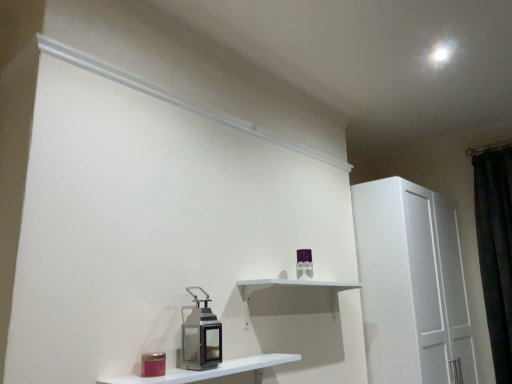
What do you see at coordinates (212, 371) in the screenshot?
I see `white glossy shelf at lower center, the first shelf in the front-to-back sequence` at bounding box center [212, 371].

This screenshot has height=384, width=512. Identify the location of white glossy shelf at lower center, the first shelf in the front-to-back sequence. (212, 371).

Find the location of a particular element. white matte shelf at center, which is the second shelf in front-to-back order is located at coordinates (293, 287).

Find the location of `dark velvet curtain at right`. dark velvet curtain at right is located at coordinates (495, 248).

This screenshot has height=384, width=512. What are the coordinates of `white glossy shelf at lower center, the first shelf in the front-to-back sequence` in the screenshot? It's located at (212, 371).

Is dark velvet curtain at right bigger than white matte shelf at center, which is the second shelf in front-to-back order?

Correct, dark velvet curtain at right is larger in size than white matte shelf at center, which is the second shelf in front-to-back order.

Could you tell me if dark velvet curtain at right is facing white matte shelf at center, which is the second shelf in front-to-back order?

No.

From the image's perspective, which is below, dark velvet curtain at right or white matte shelf at center, which is counted as the first shelf, starting from the back?

white matte shelf at center, which is counted as the first shelf, starting from the back, is shown below in the image.

Is point (505, 228) more distant than point (349, 284)?

Yes, it is behind point (349, 284).

From the image's perspective, is white glossy shelf at lower center, which ranks as the 2th shelf in back-to-front order, on top of white matte shelf at center, which is the second shelf in front-to-back order?

No, from the image's perspective, white glossy shelf at lower center, which ranks as the 2th shelf in back-to-front order, is not over white matte shelf at center, which is the second shelf in front-to-back order.

Does white glossy shelf at lower center, the first shelf in the front-to-back sequence, touch white matte shelf at center, which is counted as the first shelf, starting from the back?

No, white glossy shelf at lower center, the first shelf in the front-to-back sequence, is not touching white matte shelf at center, which is counted as the first shelf, starting from the back.

Which of these two, white glossy shelf at lower center, the first shelf in the front-to-back sequence, or white matte shelf at center, which is counted as the first shelf, starting from the back, stands taller?

With more height is white matte shelf at center, which is counted as the first shelf, starting from the back.

Which is in front, point (266, 354) or point (332, 294)?

The point (266, 354) is in front.

Between white matte shelf at center, which is the second shelf in front-to-back order, and white glossy shelf at lower center, the first shelf in the front-to-back sequence, which one has smaller width?

white matte shelf at center, which is the second shelf in front-to-back order, is thinner.

Is white matte shelf at center, which is the second shelf in front-to-back order, turned away from white glossy shelf at lower center, which ranks as the 2th shelf in back-to-front order?

No, white glossy shelf at lower center, which ranks as the 2th shelf in back-to-front order, is not at the back of white matte shelf at center, which is the second shelf in front-to-back order.

Considering the relative positions of white matte shelf at center, which is the second shelf in front-to-back order, and white glossy shelf at lower center, the first shelf in the front-to-back sequence, in the image provided, is white matte shelf at center, which is the second shelf in front-to-back order, to the left of white glossy shelf at lower center, the first shelf in the front-to-back sequence, from the viewer's perspective?

No.

From the image's perspective, which one is positioned lower, dark velvet curtain at right or metallic lantern at center?

dark velvet curtain at right is shown below in the image.

Looking at this image, is dark velvet curtain at right completely or partially outside of metallic lantern at center?

Yes, dark velvet curtain at right is outside of metallic lantern at center.

In the scene shown: Is dark velvet curtain at right to the right of metallic lantern at center from the viewer's perspective?

Yes.

From a real-world perspective, which object rests below the other?

In real-world perspective, white glossy shelf at lower center, the first shelf in the front-to-back sequence, is lower.

Consider the image. Which of these two, white glossy shelf at lower center, which ranks as the 2th shelf in back-to-front order, or dark velvet curtain at right, is smaller?

Smaller between the two is white glossy shelf at lower center, which ranks as the 2th shelf in back-to-front order.

Relative to dark velvet curtain at right, is white glossy shelf at lower center, which ranks as the 2th shelf in back-to-front order, in front or behind?

In the image, white glossy shelf at lower center, which ranks as the 2th shelf in back-to-front order, appears in front of dark velvet curtain at right.

Based on the photo, is white glossy shelf at lower center, the first shelf in the front-to-back sequence, positioned with its back to dark velvet curtain at right?

That's not correct — white glossy shelf at lower center, the first shelf in the front-to-back sequence, is not looking away from dark velvet curtain at right.

Image resolution: width=512 pixels, height=384 pixels. In order to click on the 1st shelf below when counting from the metallic lantern at center (from the image's perspective) in this screenshot , I will do `click(293, 287)`.

Is white matte shelf at center, which is the second shelf in front-to-back order, facing towards metallic lantern at center?

No, white matte shelf at center, which is the second shelf in front-to-back order, is not aimed at metallic lantern at center.

Is white matte shelf at center, which is counted as the first shelf, starting from the back, beside metallic lantern at center?

white matte shelf at center, which is counted as the first shelf, starting from the back, and metallic lantern at center are not in contact.

Between point (297, 283) and point (197, 321), which one is positioned in front?

The point (197, 321) is more forward.

Considering the sizes of objects white glossy shelf at lower center, which ranks as the 2th shelf in back-to-front order, and metallic lantern at center in the image provided, who is taller, white glossy shelf at lower center, which ranks as the 2th shelf in back-to-front order, or metallic lantern at center?

metallic lantern at center.

Based on the photo, considering the relative sizes of white glossy shelf at lower center, the first shelf in the front-to-back sequence, and metallic lantern at center in the image provided, is white glossy shelf at lower center, the first shelf in the front-to-back sequence, bigger than metallic lantern at center?

Yes.

From a real-world perspective, which is physically above, white glossy shelf at lower center, which ranks as the 2th shelf in back-to-front order, or metallic lantern at center?

metallic lantern at center, from a real-world perspective.

In the image, there is a white glossy shelf at lower center, the first shelf in the front-to-back sequence. Where is `appliance above it (from the image's perspective)`? The image size is (512, 384). appliance above it (from the image's perspective) is located at coordinates (200, 335).

From the image's perspective, count 1st shelfs downward from the dark velvet curtain at right and point to it. Please provide its 2D coordinates.

[(293, 287)]

Where is `shelf located behind the white glossy shelf at lower center, the first shelf in the front-to-back sequence`? shelf located behind the white glossy shelf at lower center, the first shelf in the front-to-back sequence is located at coordinates (293, 287).

From the image, which object appears to be farther from white glossy shelf at lower center, the first shelf in the front-to-back sequence, white matte shelf at center, which is the second shelf in front-to-back order, or metallic lantern at center?

white matte shelf at center, which is the second shelf in front-to-back order, lies further to white glossy shelf at lower center, the first shelf in the front-to-back sequence, than the other object.

Estimate the real-world distances between objects in this image. Which object is closer to metallic lantern at center, white glossy shelf at lower center, which ranks as the 2th shelf in back-to-front order, or white matte shelf at center, which is counted as the first shelf, starting from the back?

white glossy shelf at lower center, which ranks as the 2th shelf in back-to-front order.

Which object lies nearer to the anchor point metallic lantern at center, white matte shelf at center, which is the second shelf in front-to-back order, or dark velvet curtain at right?

white matte shelf at center, which is the second shelf in front-to-back order, is positioned closer to the anchor metallic lantern at center.

In the scene shown: Looking at the image, which one is located closer to white matte shelf at center, which is counted as the first shelf, starting from the back, white glossy shelf at lower center, which ranks as the 2th shelf in back-to-front order, or metallic lantern at center?

white glossy shelf at lower center, which ranks as the 2th shelf in back-to-front order, is closer to white matte shelf at center, which is counted as the first shelf, starting from the back.

Considering their positions, is white glossy shelf at lower center, which ranks as the 2th shelf in back-to-front order, positioned closer to dark velvet curtain at right than white matte shelf at center, which is the second shelf in front-to-back order?

Among the two, white matte shelf at center, which is the second shelf in front-to-back order, is located nearer to dark velvet curtain at right.

Looking at this image, from the image, which object appears to be farther from metallic lantern at center, dark velvet curtain at right or white matte shelf at center, which is counted as the first shelf, starting from the back?

The object further to metallic lantern at center is dark velvet curtain at right.

Consider the image. Considering their positions, is metallic lantern at center positioned closer to dark velvet curtain at right than white glossy shelf at lower center, which ranks as the 2th shelf in back-to-front order?

white glossy shelf at lower center, which ranks as the 2th shelf in back-to-front order, lies closer to dark velvet curtain at right than the other object.

From the image, which object appears to be nearer to white matte shelf at center, which is the second shelf in front-to-back order, dark velvet curtain at right or metallic lantern at center?

metallic lantern at center lies closer to white matte shelf at center, which is the second shelf in front-to-back order, than the other object.

Locate an element on the screen. The height and width of the screenshot is (384, 512). shelf between white glossy shelf at lower center, the first shelf in the front-to-back sequence, and dark velvet curtain at right from left to right is located at coordinates 293,287.

Where is `shelf between metallic lantern at center and white matte shelf at center, which is the second shelf in front-to-back order`? shelf between metallic lantern at center and white matte shelf at center, which is the second shelf in front-to-back order is located at coordinates (212, 371).